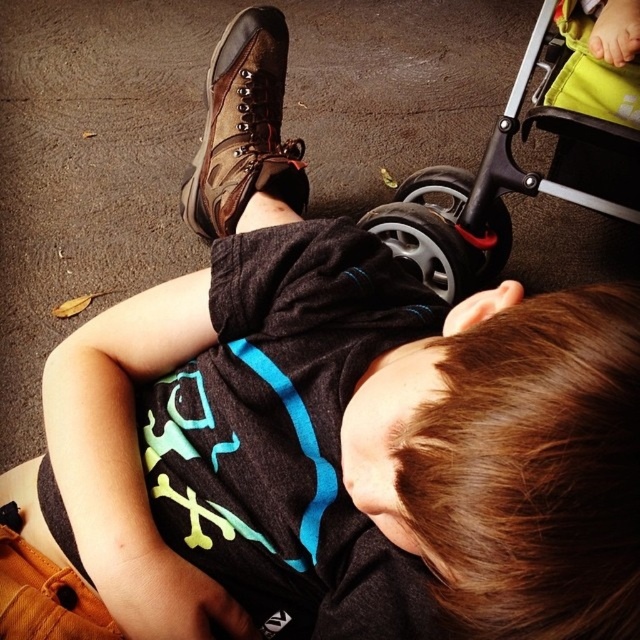
Does black rubber baby carriage at lower right appear over brown leather boot at upper center?

Incorrect, black rubber baby carriage at lower right is not positioned above brown leather boot at upper center.

Who is more distant from viewer, [579,138] or [211,68]?

The point [211,68] is behind.

Is point (477, 262) farther from camera compared to point (275, 172)?

Yes, point (477, 262) is behind point (275, 172).

Find the location of a particular element. The height and width of the screenshot is (640, 640). black rubber baby carriage at lower right is located at coordinates (493, 182).